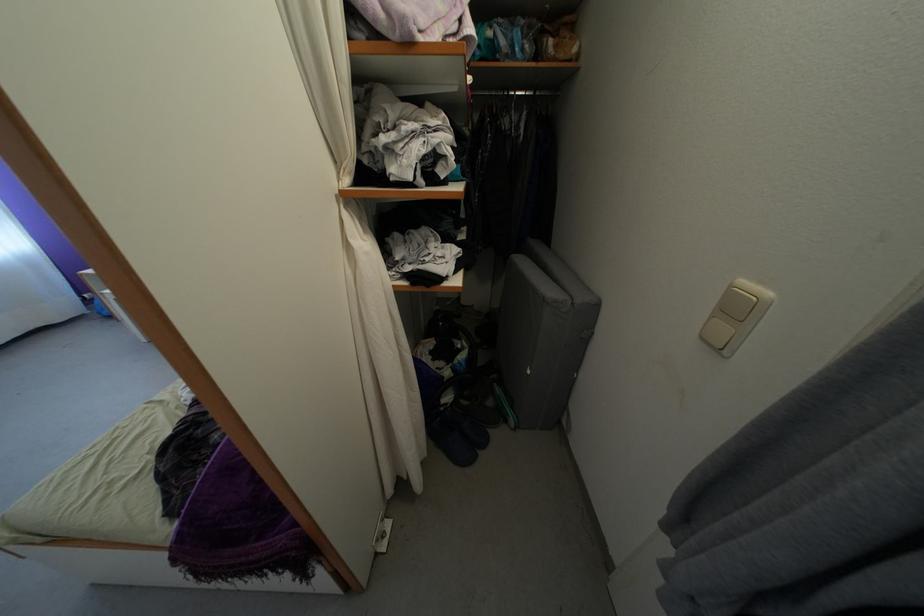
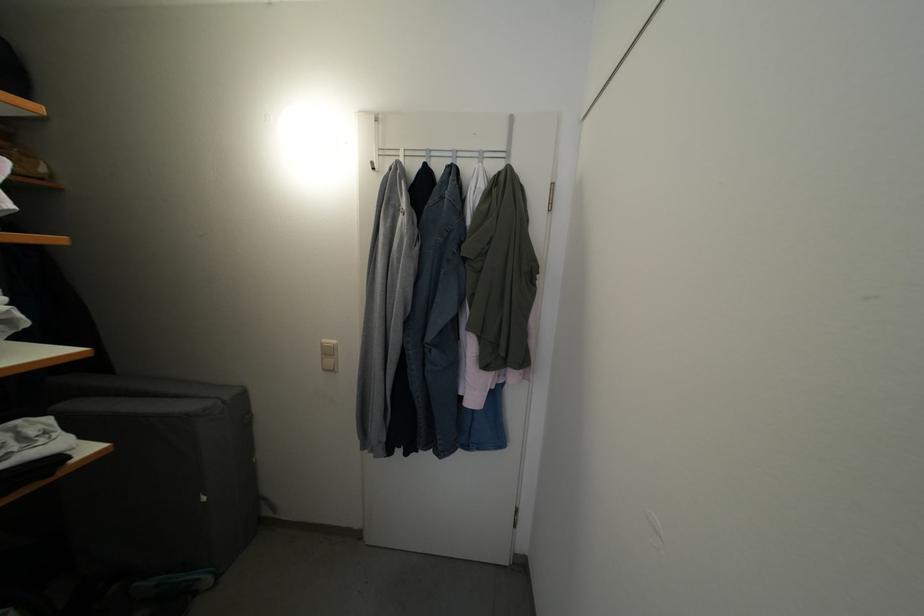
Question: The camera is either moving clockwise (left) or counter-clockwise (right) around the object. The first image is from the beginning of the video and the second image is from the end. Is the camera moving left or right when shooting the video?

Choices:
 (A) Left
 (B) Right

Answer: (A)